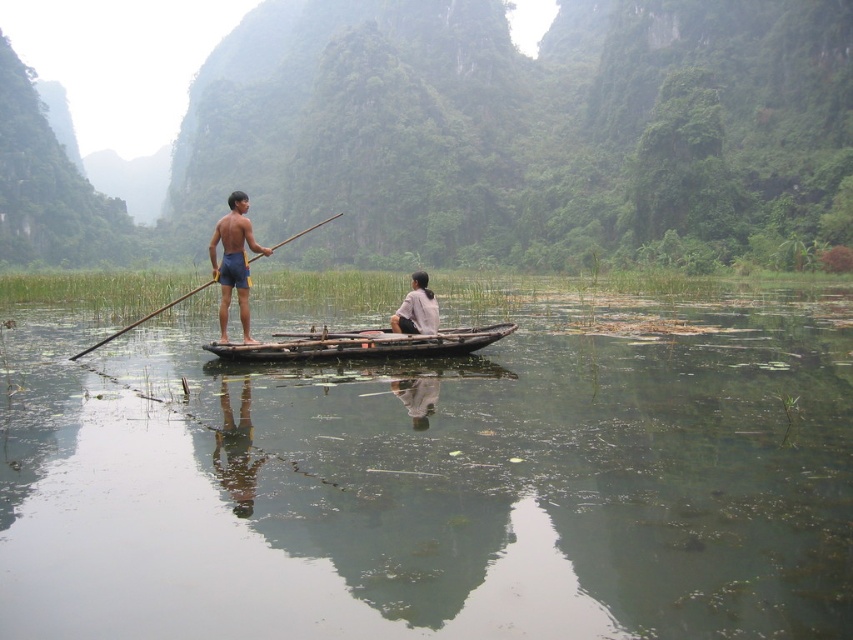
Question: Does wooden canoe at center appear on the left side of white matte shirt at center?

Choices:
 (A) yes
 (B) no

Answer: (A)

Question: Which of the following is the farthest from the observer?

Choices:
 (A) transparent wooden boat at center
 (B) brown wood paddle at center
 (C) wooden canoe at center

Answer: (B)

Question: Which point is closer to the camera?

Choices:
 (A) white matte shirt at center
 (B) transparent wooden boat at center
 (C) wooden canoe at center

Answer: (B)

Question: Among these objects, which one is nearest to the camera?

Choices:
 (A) transparent wooden boat at center
 (B) white matte shirt at center
 (C) wooden canoe at center
 (D) brown wood paddle at center

Answer: (A)

Question: Does wooden canoe at center have a larger size compared to brown wood paddle at center?

Choices:
 (A) yes
 (B) no

Answer: (B)

Question: Does transparent wooden boat at center have a larger size compared to matte blue shorts at center?

Choices:
 (A) no
 (B) yes

Answer: (B)